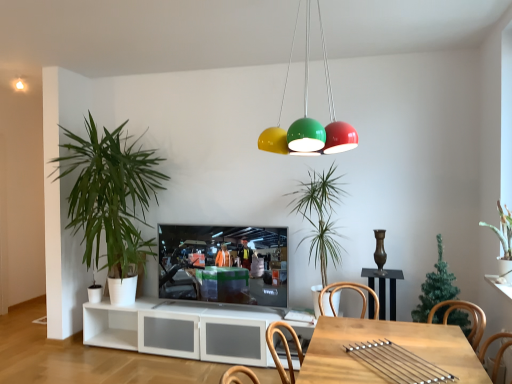
Question: From the image's perspective, is green leafy plant at center, placed as the 2th houseplant when sorted from left to right, positioned above or below green leafy plant at left, which is the fourth houseplant in right-to-left order?

Choices:
 (A) below
 (B) above

Answer: (A)

Question: Considering the positions of green leafy plant at center, placed as the 2th houseplant when sorted from left to right, and green leafy plant at left, the 1th houseplant positioned from the left, in the image, is green leafy plant at center, placed as the 2th houseplant when sorted from left to right, taller or shorter than green leafy plant at left, the 1th houseplant positioned from the left,?

Choices:
 (A) short
 (B) tall

Answer: (A)

Question: Which object is the farthest from the green matte christmas tree at center, which appears as the third houseplant when viewed from the left?

Choices:
 (A) green leafy plant at left, the 1th houseplant positioned from the left
 (B) matte black television at center
 (C) glossy plastic chandelier at upper center
 (D) green matte plant at upper right, which is the 4th houseplant in left-to-right order
 (E) green leafy plant at center, placed as the 2th houseplant when sorted from left to right

Answer: (A)

Question: Based on their relative distances, which object is nearer to the glossy plastic chandelier at upper center?

Choices:
 (A) green leafy plant at left, the 1th houseplant positioned from the left
 (B) green leafy plant at center, placed as the 2th houseplant when sorted from left to right
 (C) light brown wooden table at lower center
 (D) green matte plant at upper right, which is the 4th houseplant in left-to-right order
 (E) green matte christmas tree at center, the 2th houseplant when ordered from right to left

Answer: (B)